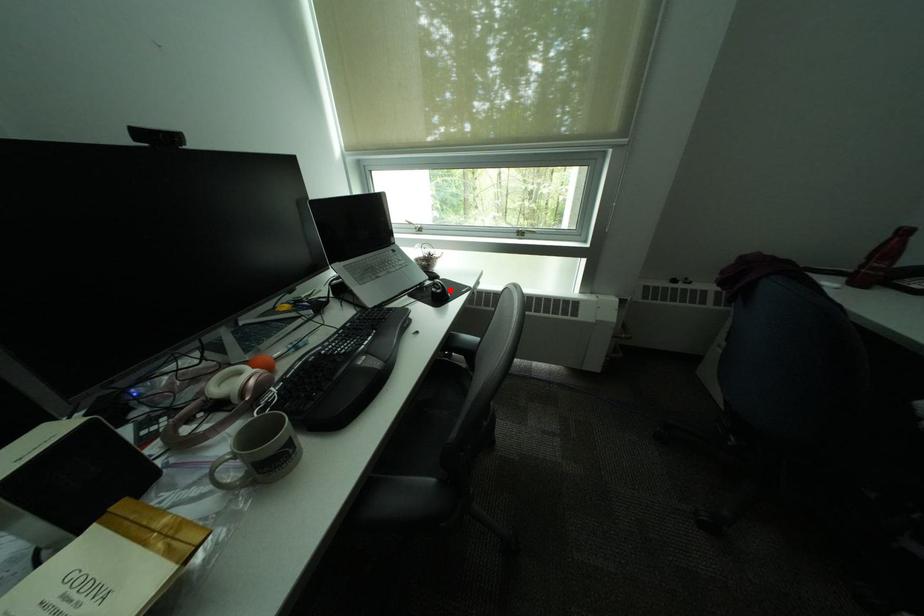
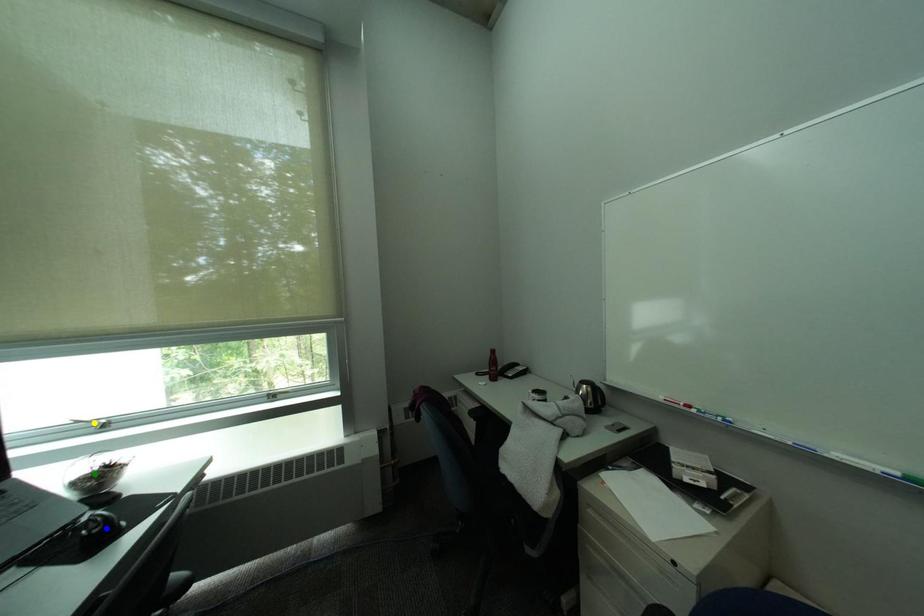
Question: I am providing you with two images of the same scene from different viewpoints. A red point is marked on the first image. You are given multiple points on the second image. Which point in image 2 represents the same 3d spot as the red point in image 1?

Choices:
 (A) blue point
 (B) yellow point
 (C) green point

Answer: (A)